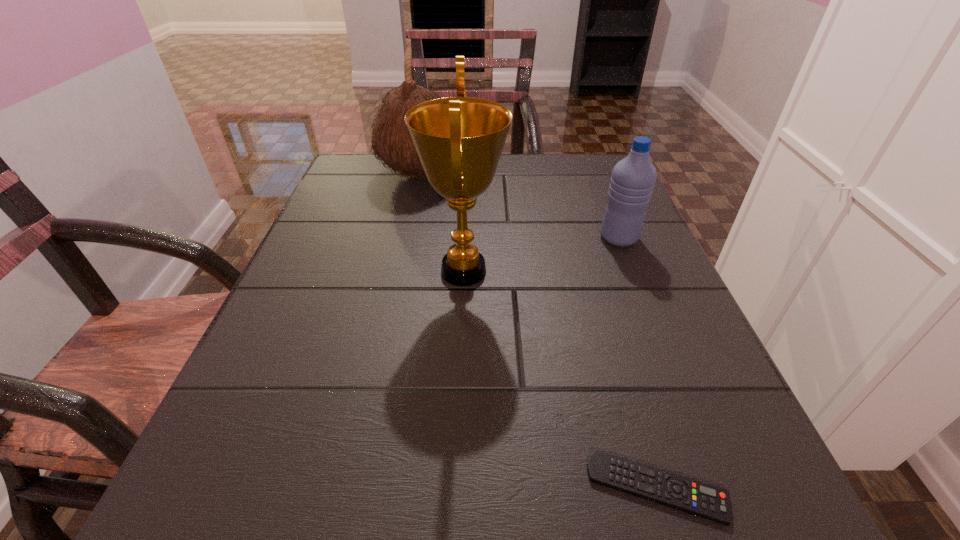
At what (x,y) coordinates should I click in order to perform the action: click on award. Please return your answer as a coordinate pair (x, y). Looking at the image, I should click on (459, 140).

Locate an element on the screen. The image size is (960, 540). the second tallest object is located at coordinates (x=392, y=141).

The width and height of the screenshot is (960, 540). I want to click on the farthest object, so click(392, 141).

In order to click on water bottle in this screenshot , I will do `click(633, 178)`.

Where is `the nearest object`? the nearest object is located at coordinates (710, 502).

Image resolution: width=960 pixels, height=540 pixels. I want to click on the shortest object, so click(x=710, y=502).

You are a GUI agent. You are given a task and a screenshot of the screen. Output one action in this format:
    pyautogui.click(x=<x>, y=<y>)
    Task: Click on the vacant space located 0.100m on the front view with handles of the award
    The width and height of the screenshot is (960, 540).
    Given the screenshot: What is the action you would take?
    pyautogui.click(x=560, y=271)

Where is `vacant point located on the surface of the farthest object`? The width and height of the screenshot is (960, 540). vacant point located on the surface of the farthest object is located at coordinates (533, 174).

Where is `vacant space located on the front of the third tallest object`? This screenshot has width=960, height=540. vacant space located on the front of the third tallest object is located at coordinates (701, 441).

Locate an element on the screen. The width and height of the screenshot is (960, 540). free space located on the back of the shortest object is located at coordinates (592, 272).